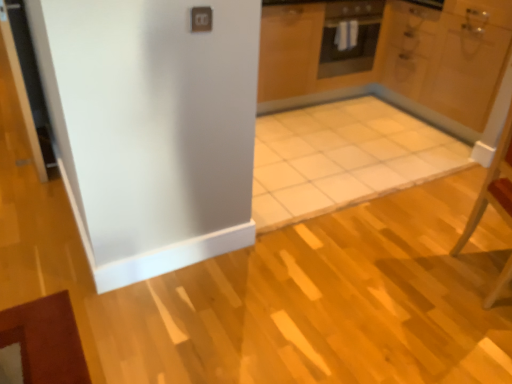
Question: In terms of width, does white glossy door at upper right look wider or thinner when compared to black matte oven at upper center?

Choices:
 (A) thin
 (B) wide

Answer: (B)

Question: From a real-world perspective, is white glossy door at upper right positioned above or below black matte oven at upper center?

Choices:
 (A) below
 (B) above

Answer: (A)

Question: Estimate the real-world distances between objects in this image. Which object is farther from the black matte oven at upper center?

Choices:
 (A) white glossy door at upper right
 (B) wooden chair at right

Answer: (B)

Question: Estimate the real-world distances between objects in this image. Which object is closer to the black matte oven at upper center?

Choices:
 (A) wooden chair at right
 (B) white glossy door at upper right

Answer: (B)